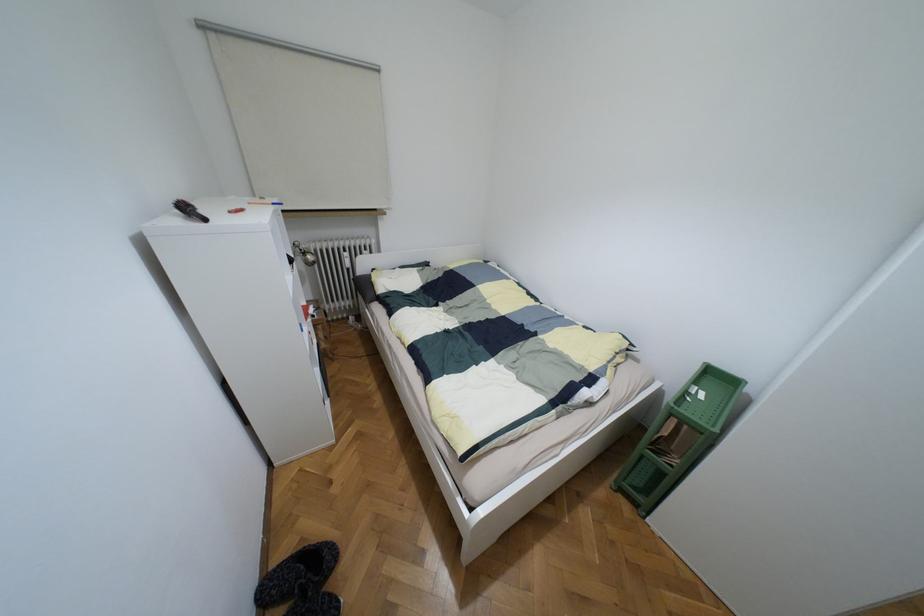
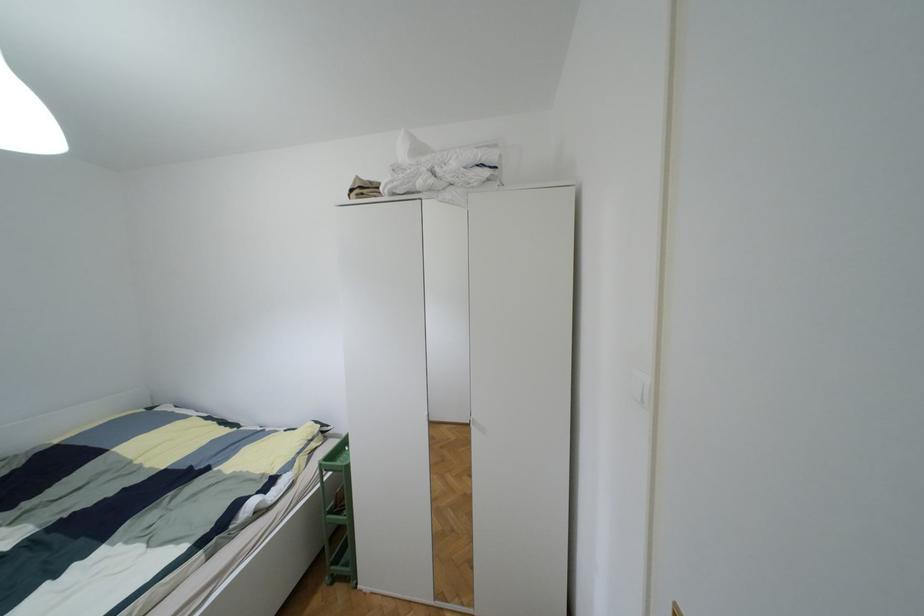
Find the pixel in the second image that matches (x=619, y=490) in the first image.

(333, 578)